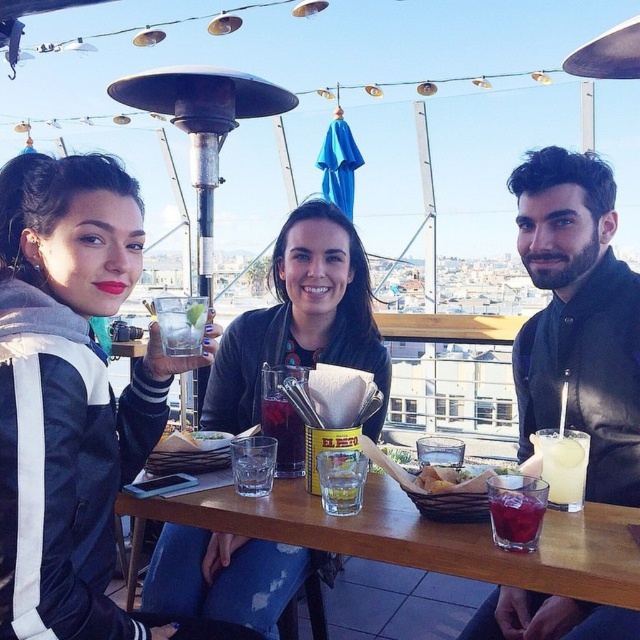
Question: Does yellow translucent glass at table right appear on the left side of yellow paper at center?

Choices:
 (A) no
 (B) yes

Answer: (A)

Question: In this image, where is matte black jacket at center located relative to translucent glass at table center?

Choices:
 (A) right
 (B) left

Answer: (A)

Question: Which of the following is the closest to the observer?

Choices:
 (A) (61, 582)
 (B) (339, 547)
 (C) (560, 454)

Answer: (A)

Question: Which of these objects is positioned closest to the golden crumbly bread at table center?

Choices:
 (A) wooden table at center
 (B) yellow translucent glass at table right
 (C) clear glass with ice at center
 (D) dark red liquid at table center

Answer: (D)

Question: Can you confirm if wooden table at center is positioned below yellow paper at center?

Choices:
 (A) yes
 (B) no

Answer: (A)

Question: Which point is closer to the camera?

Choices:
 (A) wooden table at center
 (B) yellow paper at center
 (C) translucent glass at table center

Answer: (A)